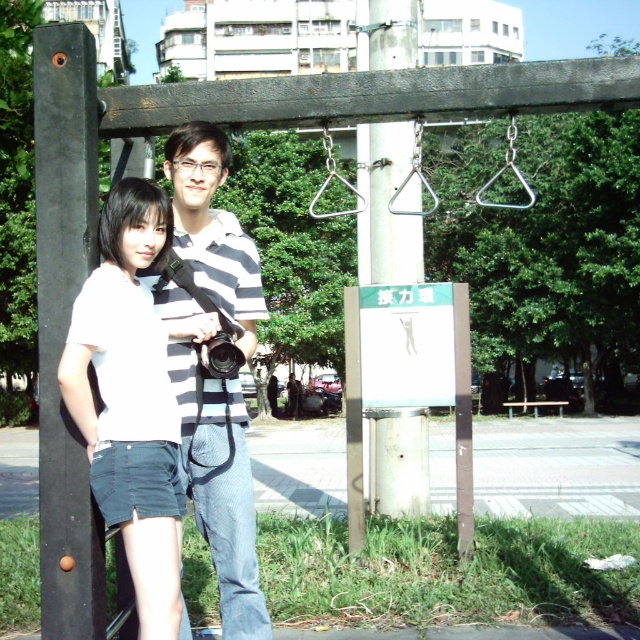
Question: Does black matte pole at left have a smaller size compared to metallic pole at center?

Choices:
 (A) no
 (B) yes

Answer: (B)

Question: Can you confirm if white matte shorts at lower left is thinner than black matte pole at left?

Choices:
 (A) yes
 (B) no

Answer: (B)

Question: Which point is closer to the camera?

Choices:
 (A) white matte shorts at lower left
 (B) metallic pole at center

Answer: (A)

Question: Can you confirm if white matte shorts at lower left is bigger than striped cotton shirt at center?

Choices:
 (A) yes
 (B) no

Answer: (B)

Question: Which of the following is the closest to the observer?

Choices:
 (A) black matte pole at left
 (B) striped cotton shirt at center
 (C) metallic pole at center
 (D) black plastic camera at center

Answer: (A)

Question: Which point is farther from the camera taking this photo?

Choices:
 (A) (218, 500)
 (B) (403, 509)

Answer: (B)